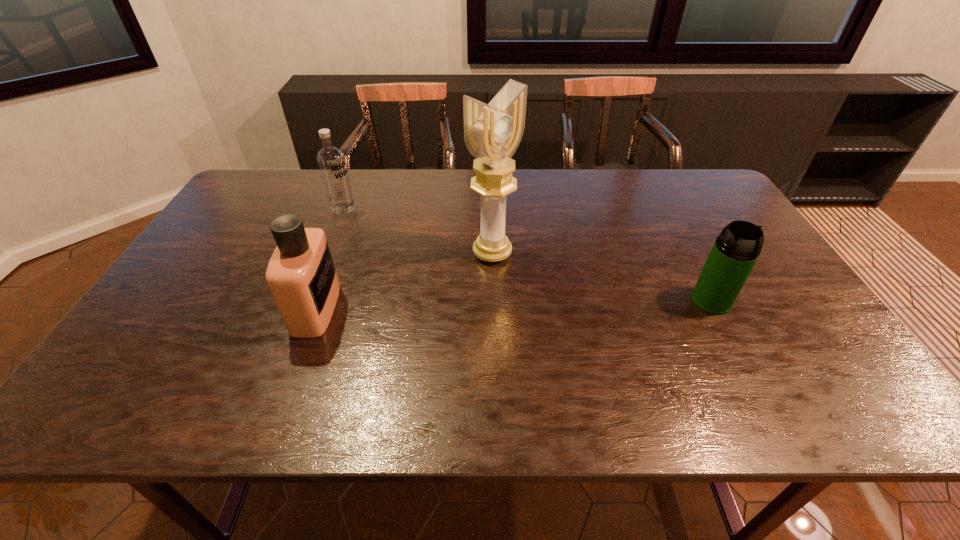
In order to click on perfume in this screenshot , I will do `click(301, 275)`.

The width and height of the screenshot is (960, 540). Identify the location of the rightmost object. (736, 250).

Find the location of a particular element. The image size is (960, 540). award is located at coordinates pyautogui.click(x=492, y=132).

I want to click on the tallest object, so click(x=492, y=132).

Identify the location of the farthest object. This screenshot has width=960, height=540. (331, 161).

Find the location of a particular element. vacant region located 0.260m on the front label of the perfume is located at coordinates (440, 308).

At what (x,y) coordinates should I click in order to perform the action: click on free space located 0.090m from the spout of the thermos bottle. Please return your answer as a coordinate pair (x, y). The width and height of the screenshot is (960, 540). Looking at the image, I should click on (734, 344).

What are the coordinates of `vacant space situated on the front-facing side of the second object from right to left` in the screenshot? It's located at (579, 312).

You are a GUI agent. You are given a task and a screenshot of the screen. Output one action in this format:
    pyautogui.click(x=<x>, y=<y>)
    Task: Click on the vacant space located 0.200m on the front-facing side of the second object from right to left
    The width and height of the screenshot is (960, 540).
    Given the screenshot: What is the action you would take?
    pyautogui.click(x=566, y=303)

Locate an element on the screen. The image size is (960, 540). blank space located on the front-facing side of the second object from right to left is located at coordinates (555, 295).